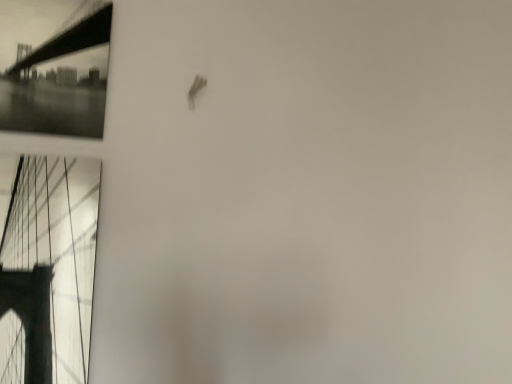
Question: Is metallic bridge at left thinner than black glossy bridge at upper left?

Choices:
 (A) yes
 (B) no

Answer: (B)

Question: Is metallic bridge at left oriented away from black glossy bridge at upper left?

Choices:
 (A) no
 (B) yes

Answer: (A)

Question: From a real-world perspective, is metallic bridge at left located beneath black glossy bridge at upper left?

Choices:
 (A) yes
 (B) no

Answer: (A)

Question: Considering the relative sizes of metallic bridge at left and black glossy bridge at upper left in the image provided, is metallic bridge at left wider than black glossy bridge at upper left?

Choices:
 (A) yes
 (B) no

Answer: (A)

Question: From the image's perspective, is metallic bridge at left located beneath black glossy bridge at upper left?

Choices:
 (A) yes
 (B) no

Answer: (A)

Question: Is metallic bridge at left at the right side of black glossy bridge at upper left?

Choices:
 (A) yes
 (B) no

Answer: (A)

Question: From a real-world perspective, does black glossy bridge at upper left sit lower than metallic bridge at left?

Choices:
 (A) yes
 (B) no

Answer: (B)

Question: Is black glossy bridge at upper left oriented away from metallic bridge at left?

Choices:
 (A) yes
 (B) no

Answer: (B)

Question: Can you confirm if black glossy bridge at upper left is positioned to the left of metallic bridge at left?

Choices:
 (A) no
 (B) yes

Answer: (B)

Question: Would you say metallic bridge at left is part of black glossy bridge at upper left's contents?

Choices:
 (A) no
 (B) yes

Answer: (A)

Question: From a real-world perspective, is black glossy bridge at upper left located higher than metallic bridge at left?

Choices:
 (A) yes
 (B) no

Answer: (A)

Question: Does black glossy bridge at upper left have a greater width compared to metallic bridge at left?

Choices:
 (A) no
 (B) yes

Answer: (A)

Question: Is point (79, 31) closer or farther from the camera than point (37, 253)?

Choices:
 (A) farther
 (B) closer

Answer: (A)